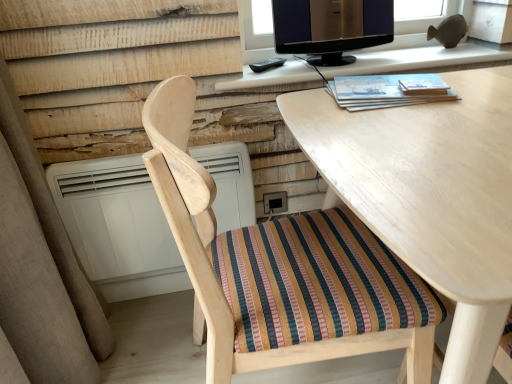
Locate an element on the screen. free spot below black glossy monitor at upper center (from a real-world perspective) is located at coordinates (330, 60).